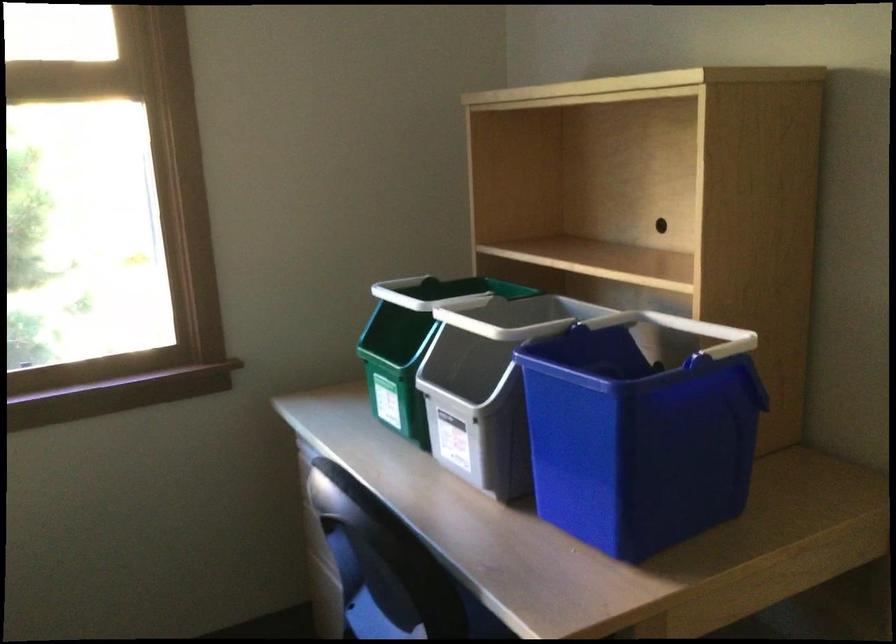
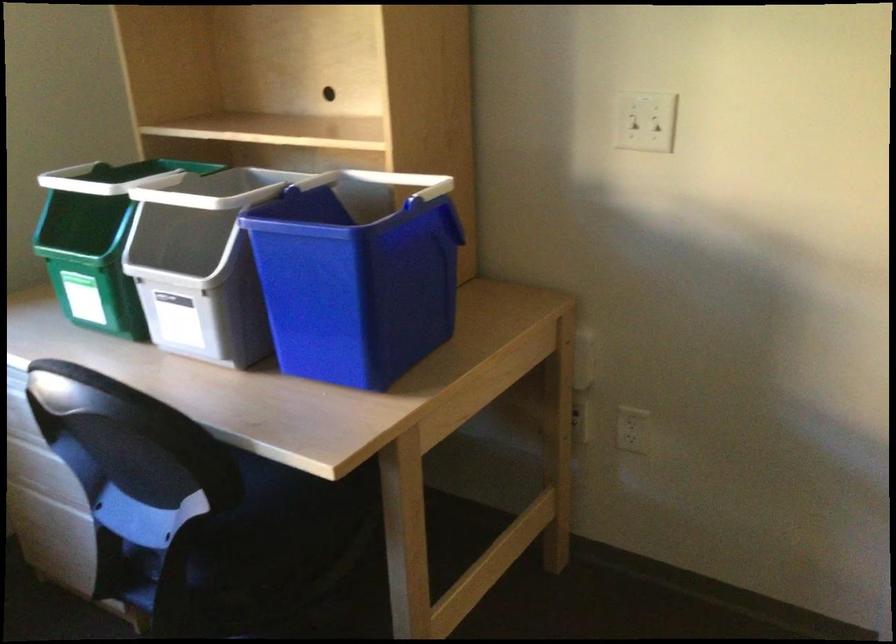
Question: The camera is either moving clockwise (left) or counter-clockwise (right) around the object. The first image is from the beginning of the video and the second image is from the end. Is the camera moving left or right when shooting the video?

Choices:
 (A) Left
 (B) Right

Answer: (A)